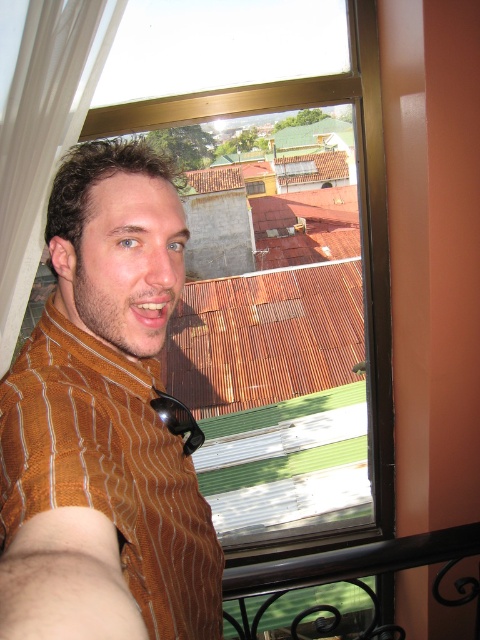
You are trying to take a selfie through the window. The brown striped shirt at center and the black wrought iron at lower right are in your shot. Which object is closer to the camera?

The brown striped shirt at center is much taller than the black wrought iron at lower right, so it is closer to the camera.

You are trying to take a photo of the residential rooftops outside the window. However, you notice that part of your brown striped shirt at center and the black wrought iron at lower right are blocking the view. Which object is closer to the camera and obstructing more of the window?

The brown striped shirt at center is closer to the viewer than the black wrought iron at lower right, so it is obstructing more of the window.

You are trying to determine if the brown striped shirt at center can completely cover the black wrought iron at lower right without overlapping any other objects in the scene. Based on their sizes, is this possible?

The brown striped shirt at center is bigger than the black wrought iron at lower right, so it can completely cover the black wrought iron at lower right without overlapping other objects.